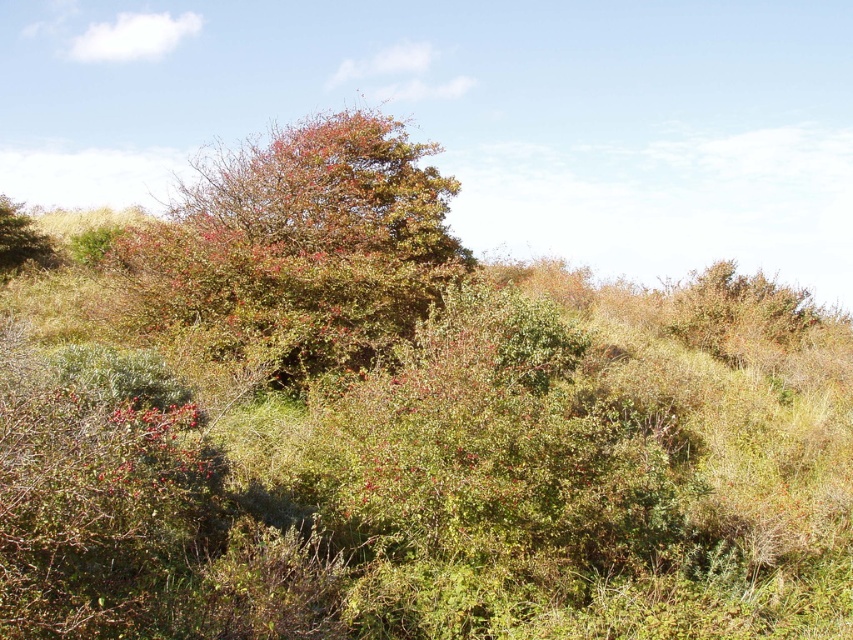
Is point (337, 250) positioned behind point (15, 260)?

No, (337, 250) is closer to viewer.

Where is `green leafy bush at center`? This screenshot has height=640, width=853. green leafy bush at center is located at coordinates (300, 248).